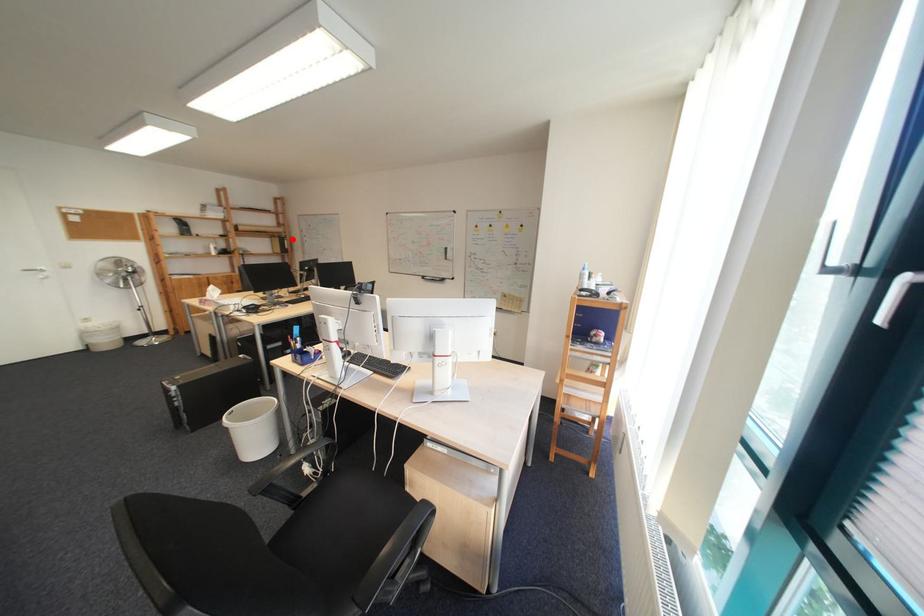
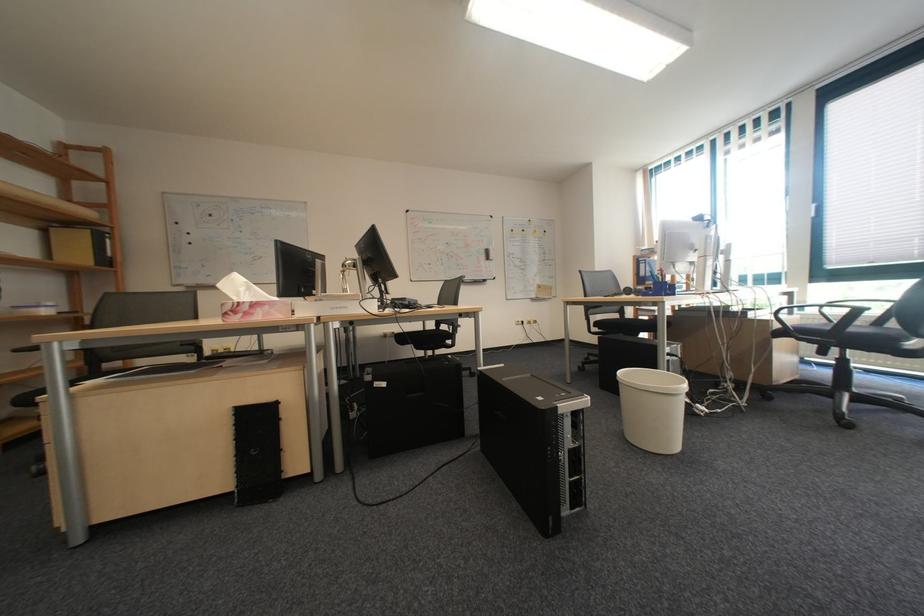
Locate, in the second image, the point that corresponds to the highlighted location in the first image.

(103, 232)